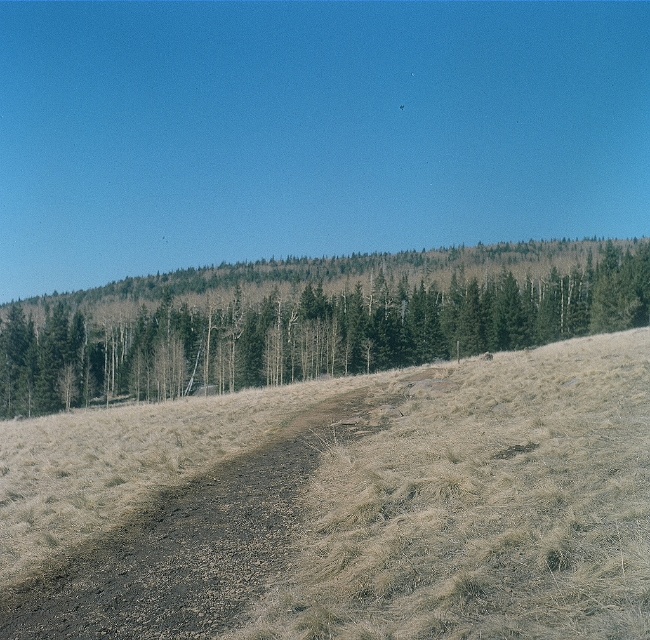
Measure the distance from green matte trees at upper center to brown dirt track at center.

340.79 feet

Which of these two, green matte trees at upper center or brown dirt track at center, stands taller?

Standing taller between the two is green matte trees at upper center.

What do you see at coordinates (306, 323) in the screenshot? The height and width of the screenshot is (640, 650). I see `green matte trees at upper center` at bounding box center [306, 323].

Image resolution: width=650 pixels, height=640 pixels. In order to click on green matte trees at upper center in this screenshot , I will do coord(306,323).